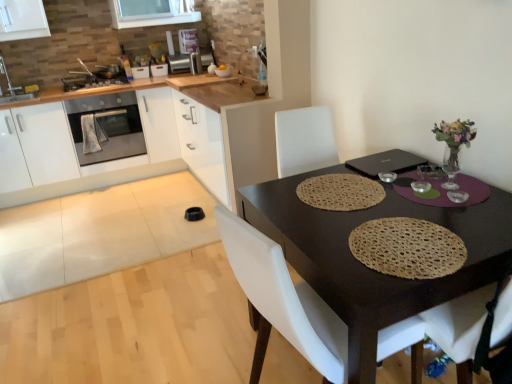
The image size is (512, 384). What do you see at coordinates (184, 140) in the screenshot? I see `wooden countertop at upper left` at bounding box center [184, 140].

How much space does satin silver toaster at upper center, which is counted as the second appliance, starting from the right, occupy horizontally?

10.30 inches.

Where is `wooden countertop at upper center`? wooden countertop at upper center is located at coordinates (227, 135).

Find the location of a particular element. brown woven placemat at center is located at coordinates tap(365, 266).

From a real-world perspective, is wooden countertop at upper center positioned above or below satin silver toaster at upper center, marked as the first appliance in a right-to-left arrangement?

Clearly, from a real-world perspective, wooden countertop at upper center is below satin silver toaster at upper center, marked as the first appliance in a right-to-left arrangement.

From the image's perspective, would you say wooden countertop at upper center is shown under satin silver toaster at upper center, marked as the first appliance in a right-to-left arrangement?

Yes, from the image's perspective, wooden countertop at upper center is beneath satin silver toaster at upper center, marked as the first appliance in a right-to-left arrangement.

Is wooden countertop at upper center facing away from satin silver toaster at upper center, the fourth appliance positioned from the left?

No, wooden countertop at upper center is not facing the opposite direction of satin silver toaster at upper center, the fourth appliance positioned from the left.

Considering the relative positions of wooden countertop at upper center and satin silver toaster at upper center, marked as the first appliance in a right-to-left arrangement, in the image provided, is wooden countertop at upper center in front of satin silver toaster at upper center, marked as the first appliance in a right-to-left arrangement,?

Yes, wooden countertop at upper center is in front of satin silver toaster at upper center, marked as the first appliance in a right-to-left arrangement.

Can you see wooden countertop at upper left touching matte stainless steel oven at left?

wooden countertop at upper left is not next to matte stainless steel oven at left, and they're not touching.

Considering the sizes of objects wooden countertop at upper left and matte stainless steel oven at left in the image provided, who is thinner, wooden countertop at upper left or matte stainless steel oven at left?

With smaller width is matte stainless steel oven at left.

Does wooden countertop at upper left have a greater height compared to matte stainless steel oven at left?

Yes, wooden countertop at upper left is taller than matte stainless steel oven at left.

From the image's perspective, does wooden countertop at upper left appear higher than matte stainless steel oven at left?

No.

Is white glossy sink at upper left in front of or behind matte stainless steel oven at left in the image?

white glossy sink at upper left is positioned closer to the viewer than matte stainless steel oven at left.

Looking at the image, does white glossy sink at upper left seem bigger or smaller compared to matte stainless steel oven at left?

Clearly, white glossy sink at upper left is smaller in size than matte stainless steel oven at left.

Is white glossy sink at upper left in contact with matte stainless steel oven at left?

No.

Between white glossy sink at upper left and matte stainless steel oven at left, which one has more height?

With more height is matte stainless steel oven at left.

Does satin silver toaster at upper center, placed as the 3th appliance when sorted from left to right, come behind wooden countertop at upper center?

That is True.

Does satin silver toaster at upper center, which is counted as the second appliance, starting from the right, have a lesser width compared to wooden countertop at upper center?

Indeed, satin silver toaster at upper center, which is counted as the second appliance, starting from the right, has a lesser width compared to wooden countertop at upper center.

In the image, is satin silver toaster at upper center, placed as the 3th appliance when sorted from left to right, on the left side or the right side of wooden countertop at upper center?

Based on their positions, satin silver toaster at upper center, placed as the 3th appliance when sorted from left to right, is located to the left of wooden countertop at upper center.

Can wooden countertop at upper center be found inside satin silver toaster at upper center, placed as the 3th appliance when sorted from left to right?

Actually, wooden countertop at upper center is outside satin silver toaster at upper center, placed as the 3th appliance when sorted from left to right.

Does metallic silver stove at upper left, which appears as the 1th appliance when viewed from the left, have a larger size compared to matte stainless steel oven at left?

Actually, metallic silver stove at upper left, which appears as the 1th appliance when viewed from the left, might be smaller than matte stainless steel oven at left.

In the image, is metallic silver stove at upper left, the 4th appliance from the right, positioned in front of or behind matte stainless steel oven at left?

Clearly, metallic silver stove at upper left, the 4th appliance from the right, is behind matte stainless steel oven at left.

From a real-world perspective, is metallic silver stove at upper left, which appears as the 1th appliance when viewed from the left, beneath matte stainless steel oven at left?

Actually, metallic silver stove at upper left, which appears as the 1th appliance when viewed from the left, is physically above matte stainless steel oven at left in the real world.

Could you measure the distance between metallic silver stove at upper left, which appears as the 1th appliance when viewed from the left, and matte stainless steel oven at left?

metallic silver stove at upper left, which appears as the 1th appliance when viewed from the left, and matte stainless steel oven at left are 53.09 centimeters apart.

From a real-world perspective, which object stands above the other?

satin silver toaster at upper center, the fourth appliance positioned from the left, from a real-world perspective.

Who is shorter, satin silver toaster at upper center, the fourth appliance positioned from the left, or matte stainless steel oven at left?

Standing shorter between the two is satin silver toaster at upper center, the fourth appliance positioned from the left.

Does satin silver toaster at upper center, marked as the first appliance in a right-to-left arrangement, appear on the left side of matte stainless steel oven at left?

In fact, satin silver toaster at upper center, marked as the first appliance in a right-to-left arrangement, is to the right of matte stainless steel oven at left.

Between satin silver toaster at upper center, the fourth appliance positioned from the left, and matte stainless steel oven at left, which one has larger width?

matte stainless steel oven at left is wider.

Does metallic silver stove at upper left, the 4th appliance from the right, have a larger size compared to brown woven placemat at center?

Actually, metallic silver stove at upper left, the 4th appliance from the right, might be smaller than brown woven placemat at center.

From a real-world perspective, which object stands above the other?

metallic silver stove at upper left, which appears as the 1th appliance when viewed from the left.

Is metallic silver stove at upper left, which appears as the 1th appliance when viewed from the left, placed right next to brown woven placemat at center?

No.

Locate an element on the screen. appliance that is the 3rd one when counting upward from the wooden countertop at upper center (from the image's perspective) is located at coordinates (195, 63).

This screenshot has height=384, width=512. What are the coordinates of `countertop that appears in front of the matte stainless steel oven at left` in the screenshot? It's located at (184, 140).

Based on their spatial positions, is metallic silver stove at upper left, the 4th appliance from the right, or woven beige placemat at table center closer to matte stainless steel oven at left?

metallic silver stove at upper left, the 4th appliance from the right, is closer to matte stainless steel oven at left.

Based on their spatial positions, is metallic silver stove at upper left, the 4th appliance from the right, or matte stainless steel oven at left further from brown woven placemat at center?

metallic silver stove at upper left, the 4th appliance from the right, is further to brown woven placemat at center.

When comparing their distances from wooden countertop at upper center, does satin silver toaster at upper center, marked as the first appliance in a right-to-left arrangement, or woven beige placemat at table center seem closer?

Among the two, satin silver toaster at upper center, marked as the first appliance in a right-to-left arrangement, is located nearer to wooden countertop at upper center.

Consider the image. Looking at the image, which one is located further to metallic silver toaster at upper left, the 3th appliance in the right-to-left sequence, satin silver toaster at upper center, which is counted as the second appliance, starting from the right, or satin silver toaster at upper center, the fourth appliance positioned from the left?

satin silver toaster at upper center, the fourth appliance positioned from the left.

Based on their spatial positions, is matte stainless steel oven at left or white glossy sink at upper left further from satin silver toaster at upper center, marked as the first appliance in a right-to-left arrangement?

white glossy sink at upper left lies further to satin silver toaster at upper center, marked as the first appliance in a right-to-left arrangement, than the other object.

Considering their positions, is brown woven placemat at center positioned closer to satin silver toaster at upper center, placed as the 3th appliance when sorted from left to right, than woven beige placemat at table center?

The object closer to satin silver toaster at upper center, placed as the 3th appliance when sorted from left to right, is brown woven placemat at center.

Looking at the image, which one is located further to woven beige placemat at table center, wooden countertop at upper center or wooden countertop at upper left?

Based on the image, wooden countertop at upper left appears to be further to woven beige placemat at table center.

From the image, which object appears to be farther from metallic silver stove at upper left, which appears as the 1th appliance when viewed from the left, wooden countertop at upper center or satin silver toaster at upper center, placed as the 3th appliance when sorted from left to right?

Among the two, wooden countertop at upper center is located further to metallic silver stove at upper left, which appears as the 1th appliance when viewed from the left.

Locate an element on the screen. This screenshot has height=384, width=512. countertop between brown woven placemat at center and metallic silver stove at upper left, which appears as the 1th appliance when viewed from the left, in the front-back direction is located at coordinates (184, 140).

Locate an element on the screen. This screenshot has width=512, height=384. sink between brown woven placemat at center and metallic silver stove at upper left, the 4th appliance from the right, along the z-axis is located at coordinates (16, 88).

The height and width of the screenshot is (384, 512). In order to click on appliance between brown woven placemat at center and satin silver toaster at upper center, marked as the first appliance in a right-to-left arrangement, along the z-axis in this screenshot , I will do `click(93, 80)`.

Identify the location of kitchen appliance located between white glossy sink at upper left and wooden countertop at upper center in the left-right direction. Image resolution: width=512 pixels, height=384 pixels. (106, 127).